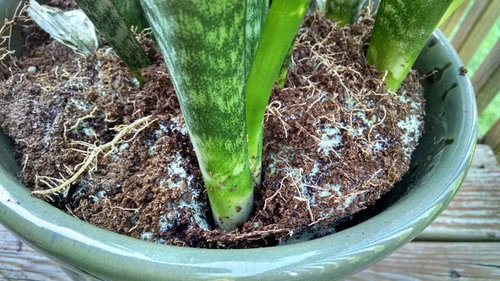
Locate an element on the screen. This screenshot has height=281, width=500. plant pot is located at coordinates (392, 237).